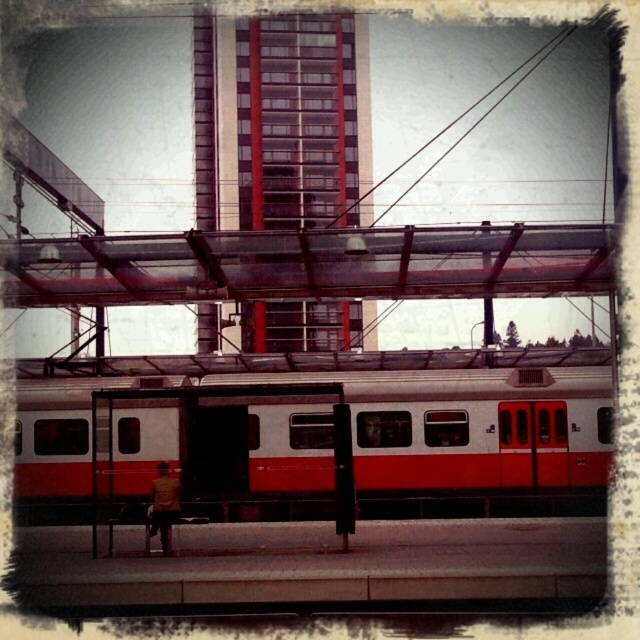
Question: Where is white glossy train at center located in relation to red glass building at center in the image?

Choices:
 (A) below
 (B) above

Answer: (A)

Question: From the image, what is the correct spatial relationship of white glossy train at center in relation to red glass building at center?

Choices:
 (A) right
 (B) left

Answer: (A)

Question: Which object appears farthest from the camera in this image?

Choices:
 (A) white glossy train at center
 (B) red glass building at center

Answer: (B)

Question: Is white glossy train at center positioned in front of red glass building at center?

Choices:
 (A) no
 (B) yes

Answer: (B)